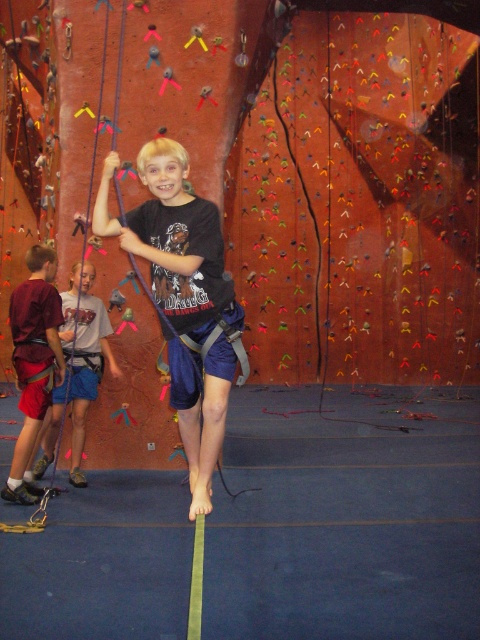
You are a fitness instructor observing a climbing session. You notice two participants wearing shorts. One is wearing matte blue shorts at center and the other red cotton shorts at left. Which participant has wider shorts?

The matte blue shorts at center has a greater width than the red cotton shorts at left, so the participant wearing the matte blue shorts at center has wider shorts.

You are a photographer positioned at the entrance of the rock climbing facility. You want to capture a photo of the matte blue shorts at center. Where should you aim your camera to ensure the shorts are in the frame?

You should aim your camera at point (173,241) to capture the matte blue shorts at center in the frame.

You are a climber preparing to grab two holds on the climbing wall. The first hold is at point (173, 352) and the second is at point (76, 364). Which hold should you reach for first if you want to start with the one closer to you?

You should reach for the hold at point (173, 352) first because it is closer to the viewer than point (76, 364).